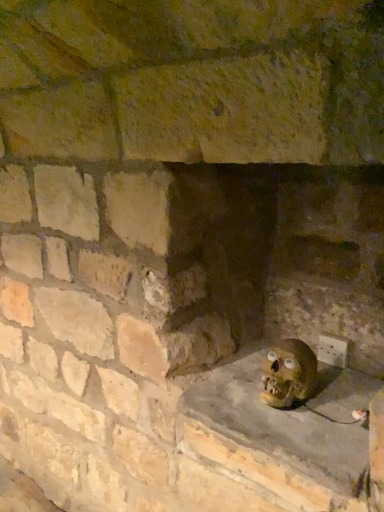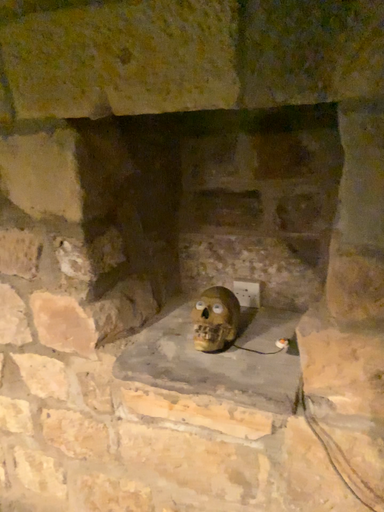
Question: How did the camera likely rotate when shooting the video?

Choices:
 (A) rotated right
 (B) rotated left

Answer: (A)